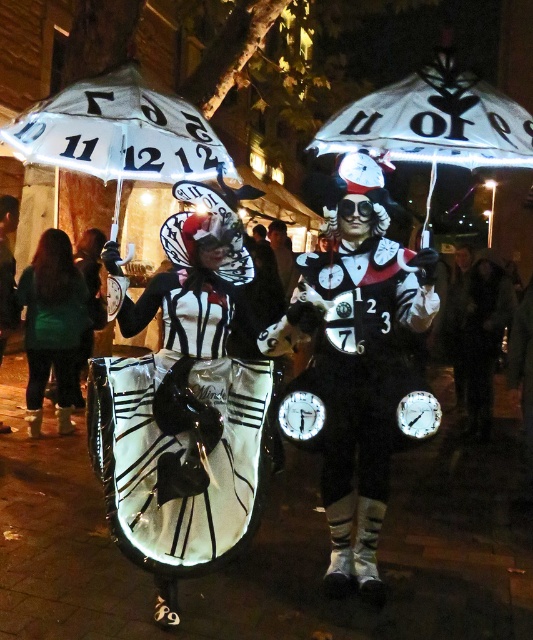
Question: Among these objects, which one is nearest to the camera?

Choices:
 (A) matte black fabric dress at center
 (B) white paper umbrella at upper center

Answer: (B)

Question: Which point is farther from the camera taking this photo?

Choices:
 (A) 87,314
 (B) 384,253
 (C) 513,120
 (D) 126,122

Answer: (A)

Question: Does white paper umbrella at upper left have a larger size compared to white paper umbrella at upper center?

Choices:
 (A) no
 (B) yes

Answer: (B)

Question: Which point is closer to the camera?

Choices:
 (A) (169, 504)
 (B) (344, 108)
 (C) (70, 333)

Answer: (A)

Question: Can you confirm if matte black fabric dress at center is positioned above matte black costume at center?

Choices:
 (A) yes
 (B) no

Answer: (B)

Question: Is matte black fabric dress at center below green fabric jacket at lower left?

Choices:
 (A) yes
 (B) no

Answer: (A)